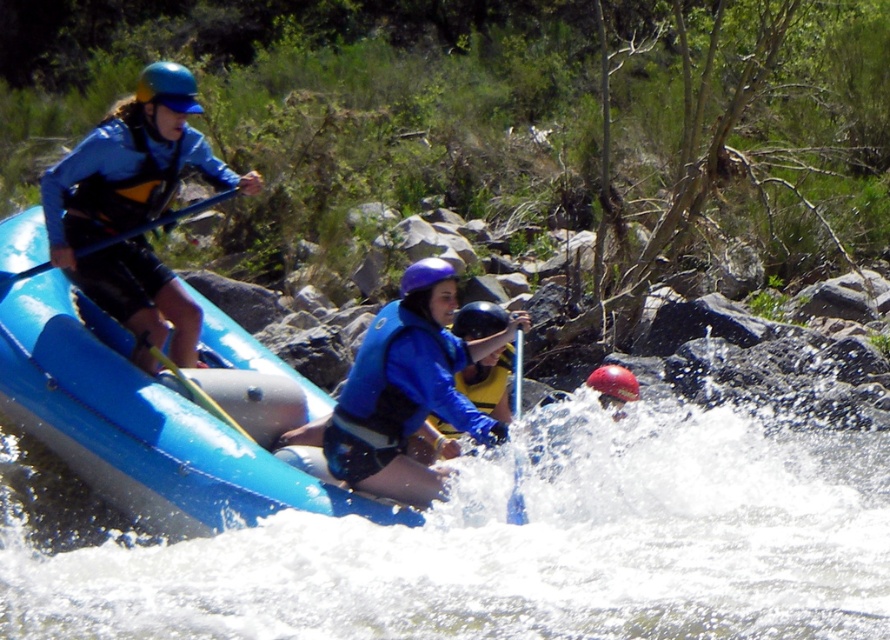
Question: Which of the following is the closest to the observer?

Choices:
 (A) (616, 419)
 (B) (443, 452)

Answer: (B)

Question: In this image, where is shiny blue helmet at upper left located relative to matte black paddle at upper left?

Choices:
 (A) below
 (B) above

Answer: (B)

Question: Can you confirm if blue matte life vest at center is positioned below shiny blue helmet at upper left?

Choices:
 (A) yes
 (B) no

Answer: (A)

Question: Can you confirm if blue matte life vest at center is smaller than smooth plastic paddle at center?

Choices:
 (A) yes
 (B) no

Answer: (B)

Question: Which of these objects is positioned farthest from the purple matte helmet at center?

Choices:
 (A) rubber helmet at center
 (B) shiny blue helmet at upper left
 (C) white frothy water at center

Answer: (B)

Question: Considering the real-world distances, which object is farthest from the rubber helmet at center?

Choices:
 (A) matte black paddle at upper left
 (B) matte blue helmet at center
 (C) matte blue helmet at upper left

Answer: (C)